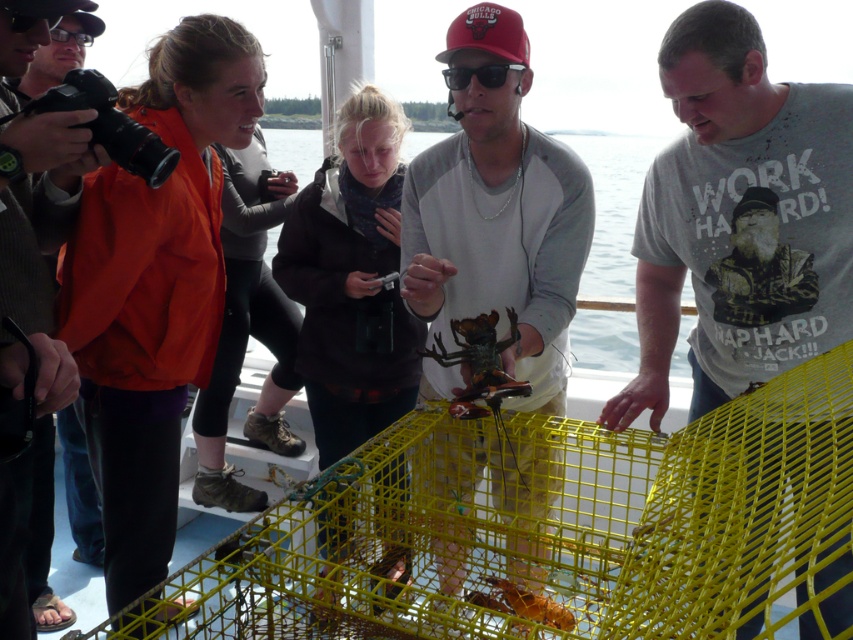
Question: Which point is farther to the camera?

Choices:
 (A) (450, 209)
 (B) (61, 221)
 (C) (643, 337)
 (D) (453, 90)

Answer: (C)

Question: Which of the following is the closest to the observer?

Choices:
 (A) gray cotton t-shirt at center
 (B) black plastic goggles at center
 (C) matte black camera at left
 (D) shiny metallic lobster at center

Answer: (D)

Question: Which point is farther to the camera?

Choices:
 (A) matte black camera at left
 (B) black plastic goggles at center
 (C) shiny metallic lobster at center
 (D) gray cotton t-shirt at center

Answer: (B)

Question: Does gray cotton t-shirt at center appear under black plastic goggles at center?

Choices:
 (A) no
 (B) yes

Answer: (B)

Question: From the image, what is the correct spatial relationship of shiny metallic lobster at center in relation to matte black camera at left?

Choices:
 (A) above
 (B) below

Answer: (B)

Question: Does shiny metallic lobster at center have a larger size compared to black plastic goggles at center?

Choices:
 (A) no
 (B) yes

Answer: (B)